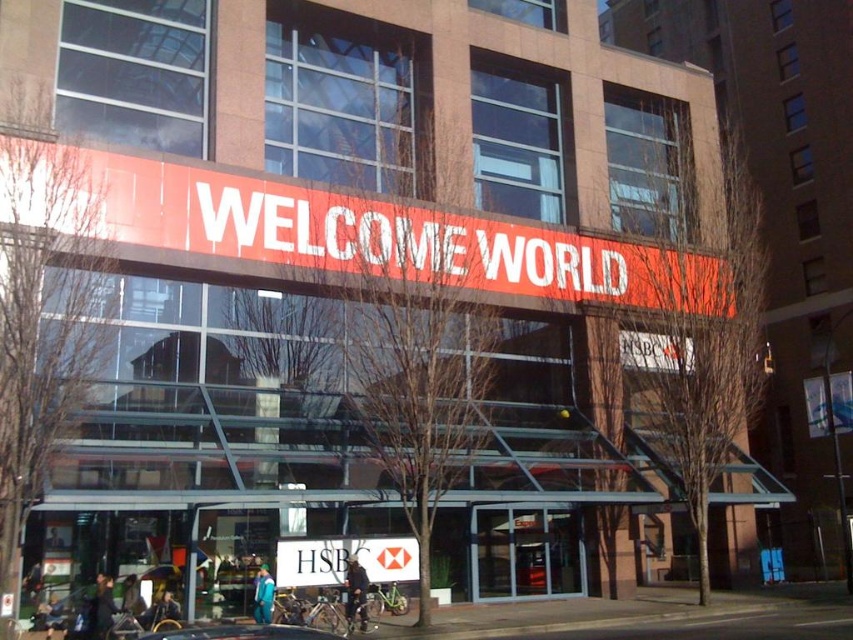
Between white paper sign at center and metallic silver car at lower center, which one appears on the left side from the viewer's perspective?

metallic silver car at lower center

Looking at this image, who is positioned more to the right, white paper sign at center or metallic silver car at lower center?

white paper sign at center is more to the right.

Where is `white paper sign at center`? The image size is (853, 640). white paper sign at center is located at coordinates (344, 561).